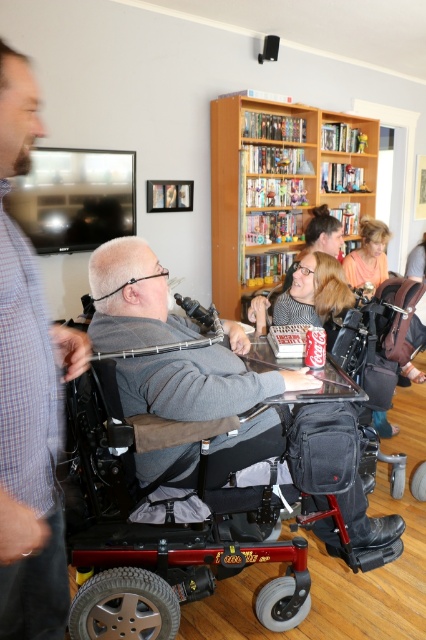
Can you confirm if gray plaid shirt at left is wider than gray fabric wheelchair at center?

Incorrect, gray plaid shirt at left's width does not surpass gray fabric wheelchair at center's.

Does gray plaid shirt at left have a larger size compared to gray fabric wheelchair at center?

Actually, gray plaid shirt at left might be smaller than gray fabric wheelchair at center.

The image size is (426, 640). I want to click on gray plaid shirt at left, so click(28, 394).

Is gray plaid shirt at left below wooden bookshelf at upper center?

Indeed, gray plaid shirt at left is positioned under wooden bookshelf at upper center.

Which is in front, point (5, 401) or point (221, 106)?

Point (5, 401)

Is point (36, 120) positioned behind point (296, 124)?

That is False.

Where is `gray plaid shirt at left`? The height and width of the screenshot is (640, 426). gray plaid shirt at left is located at coordinates (28, 394).

Who is lower down, gray fabric wheelchair at center or wooden bookshelf at upper center?

gray fabric wheelchair at center is below.

Measure the distance from gray fabric wheelchair at center to wooden bookshelf at upper center.

gray fabric wheelchair at center and wooden bookshelf at upper center are 8.76 feet apart.

I want to click on gray fabric wheelchair at center, so click(x=203, y=380).

Where is `gray fabric wheelchair at center`? The height and width of the screenshot is (640, 426). gray fabric wheelchair at center is located at coordinates (203, 380).